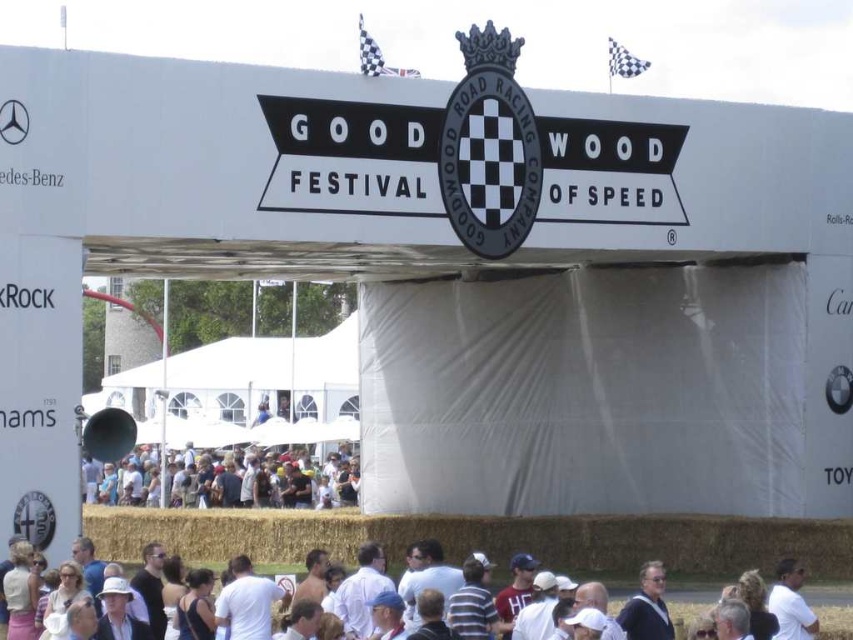
You are standing at the entrance of the Goodwood Festival of Speed. There are two points marked in the scene. The first point is at coordinates point (172, 624) and the second is at point (303, 452). Which point is closer to you?

Point (172, 624) is closer to the viewer than point (303, 452).

You are a photographer at the Goodwood Festival of Speed. You need to capture a photo of the white cotton crowd at center and the white matte shirt at lower right. Based on their positions, which object is closer to the camera?

The white cotton crowd at center is closer to the camera because it is positioned below the white matte shirt at lower right, indicating it is in front.